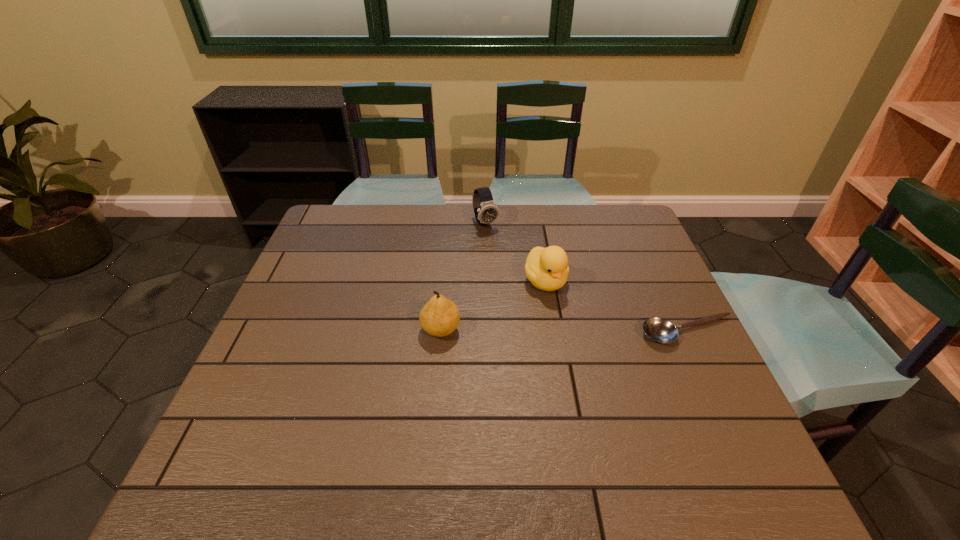
Identify the location of vacant space on the desktop that is between the pear and the shortest object and is positioned on the face of the second object from left to right. (552, 331).

Locate an element on the screen. Image resolution: width=960 pixels, height=540 pixels. vacant space on the desktop that is between the leftmost object and the rightmost object and is positioned on the front-facing side of the duck is located at coordinates (583, 331).